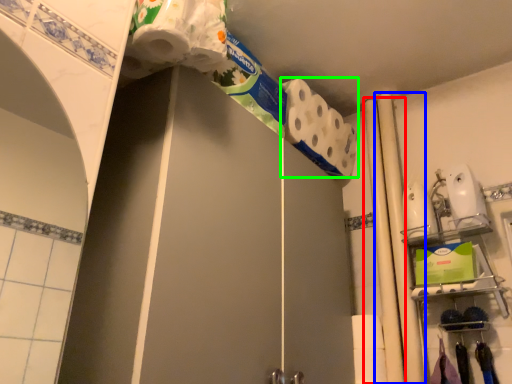
Question: Considering the real-world distances, which object is farthest from beam (highlighted by a red box)? beam (highlighted by a blue box) or toilet paper (highlighted by a green box)?

Choices:
 (A) beam
 (B) toilet paper

Answer: (B)